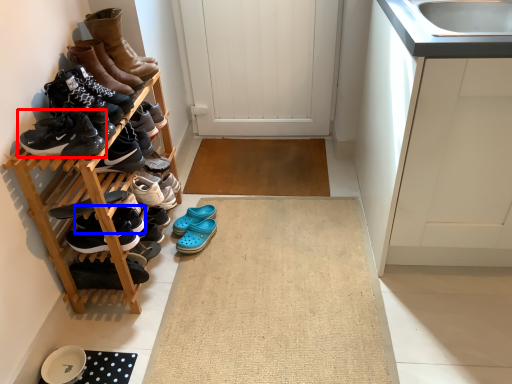
Question: Which of the following is the closest to the observer, footwear (highlighted by a red box) or shoe (highlighted by a blue box)?

Choices:
 (A) footwear
 (B) shoe

Answer: (A)